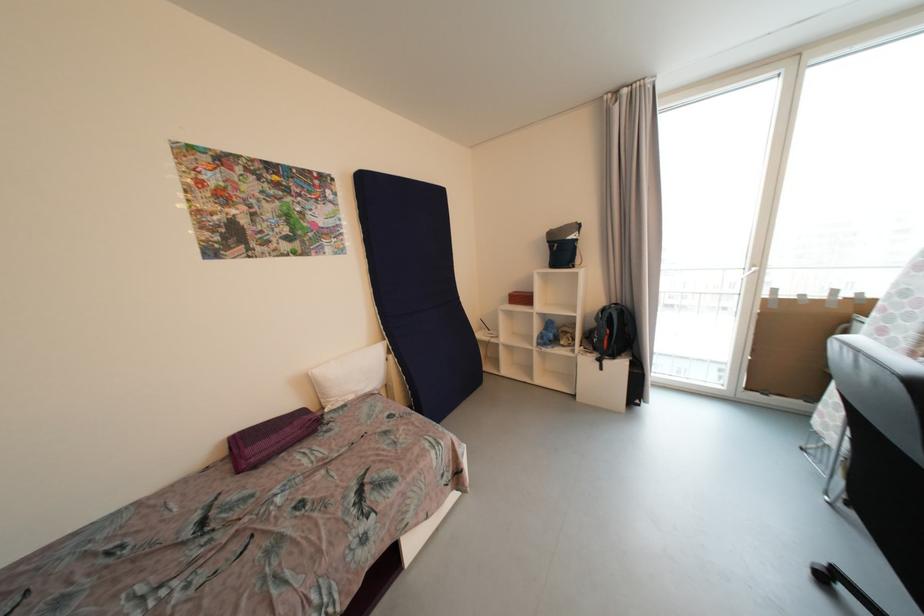
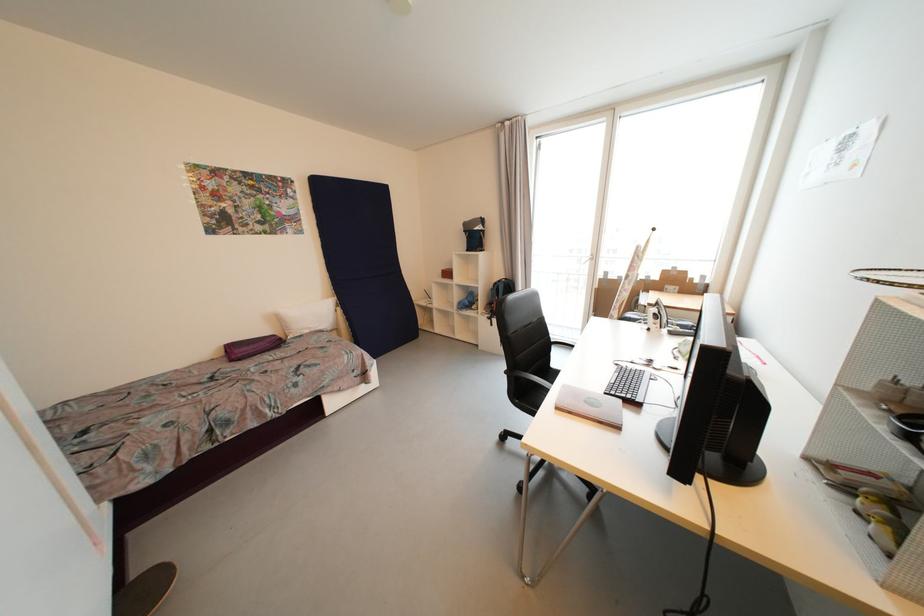
Locate, in the second image, the point that corresponds to point 315,386 in the first image.

(283, 321)